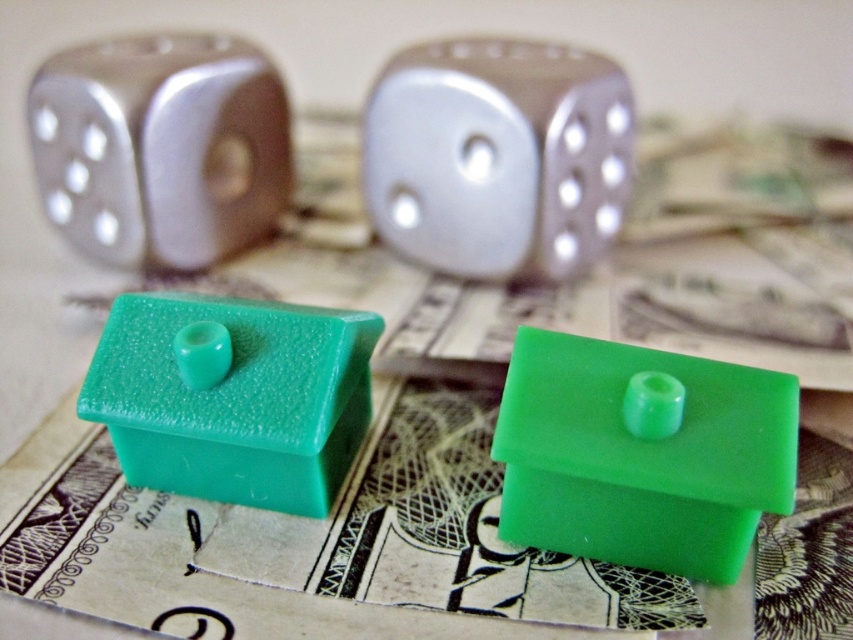
You are a small toy house made of glossy green material. You want to roll the metallic silver die at center towards yourself. Can you reach it if you can move 1.2 meters?

The metallic silver die at center is 1.35 meters away from the viewer. Since the toy house can only move 1.2 meters, it cannot reach the die.

You are a game designer creating a new board game that uses both the teal matte house at center and the metallic silver die at center. To ensure players can easily distinguish these items during gameplay, which object should be placed closer to the players so they can see it better?

The metallic silver die at center should be placed closer to the players because the teal matte house at center is behind the metallic silver die at center, making it naturally farther away from the players.